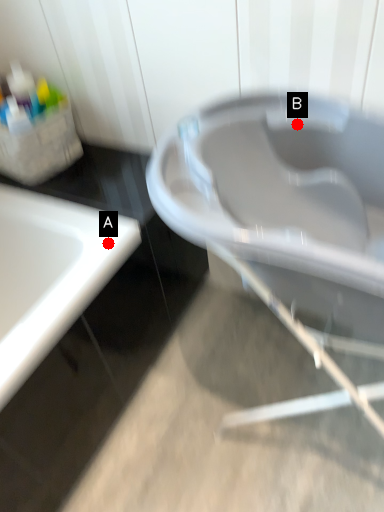
Question: Two points are circled on the image, labeled by A and B beside each circle. Which point is farther from the camera taking this photo?

Choices:
 (A) A is further
 (B) B is further

Answer: (A)